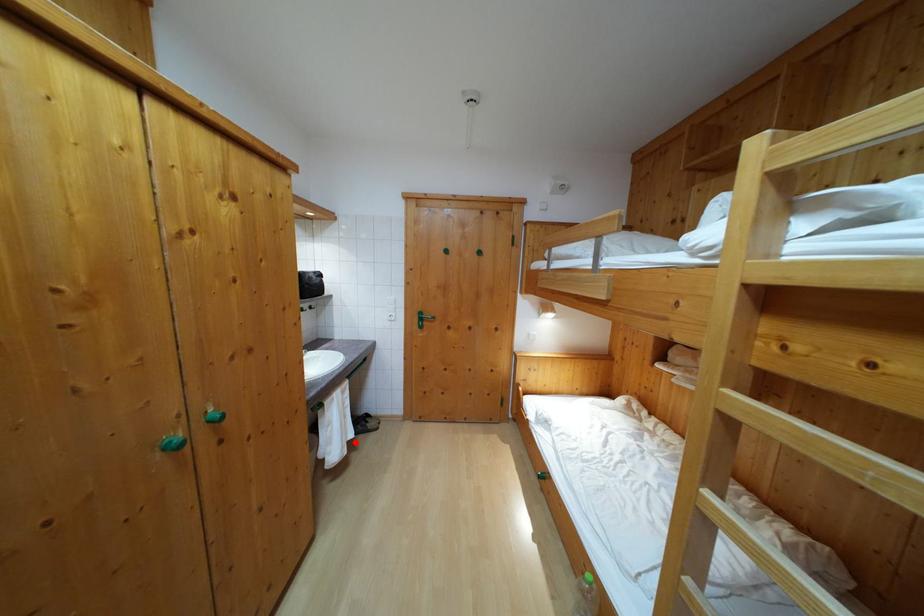
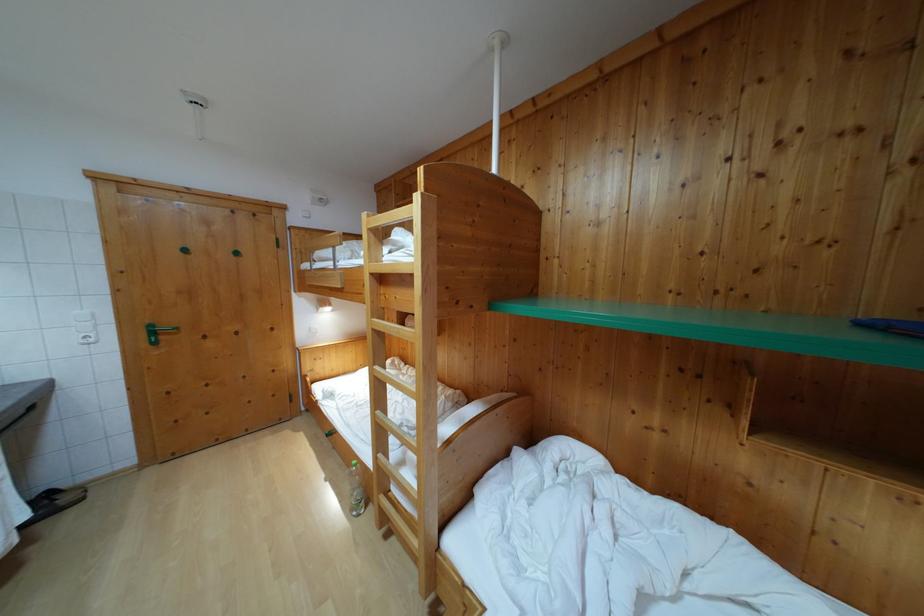
In the second image, find the point that corresponds to the highlighted location in the first image.

(28, 524)